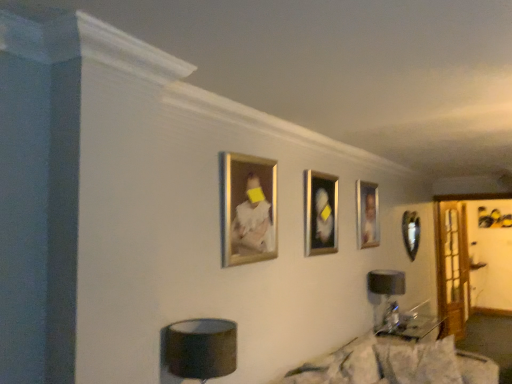
Question: Is point (356, 190) closer or farther from the camera than point (466, 296)?

Choices:
 (A) farther
 (B) closer

Answer: (B)

Question: Looking at the image, does gold-framed portrait at center, which is the 3th picture frame from front to back, seem bigger or smaller compared to clear glass door at right?

Choices:
 (A) big
 (B) small

Answer: (B)

Question: Based on their relative distances, which object is farther from the black fabric table lamp at lower right, which ranks as the first table lamp in right-to-left order?

Choices:
 (A) gold-framed portrait at center, marked as the second picture frame in a back-to-front arrangement
 (B) matte black lampshade at lower center, the second table lamp in the back-to-front sequence
 (C) metallic silver picture frame at right, which is the fourth picture frame in front-to-back order
 (D) metallic silver picture frame at center, which appears as the second picture frame when viewed from the front
 (E) clear glass door at right

Answer: (B)

Question: Estimate the real-world distances between objects in this image. Which object is farther from the white textured pillow at lower right, placed as the second pillow when sorted from left to right?

Choices:
 (A) black fabric table lamp at lower right, which is the 1th table lamp from back to front
 (B) metallic silver picture frame at right, which is the fourth picture frame in front-to-back order
 (C) matte black lampshade at lower center, the second table lamp in the back-to-front sequence
 (D) clear glass door at right
 (E) metallic silver picture frame at center, which appears as the second picture frame when viewed from the front

Answer: (D)